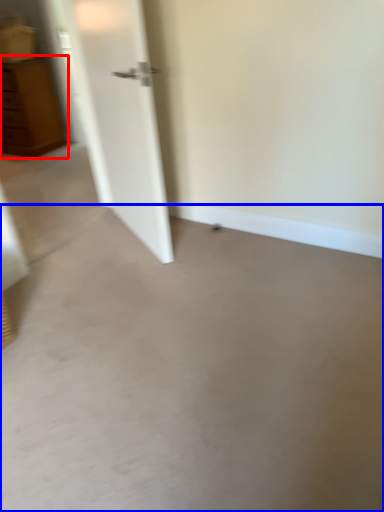
Question: Which of the following is the closest to the observer, chest of drawers (highlighted by a red box) or concrete (highlighted by a blue box)?

Choices:
 (A) chest of drawers
 (B) concrete

Answer: (B)